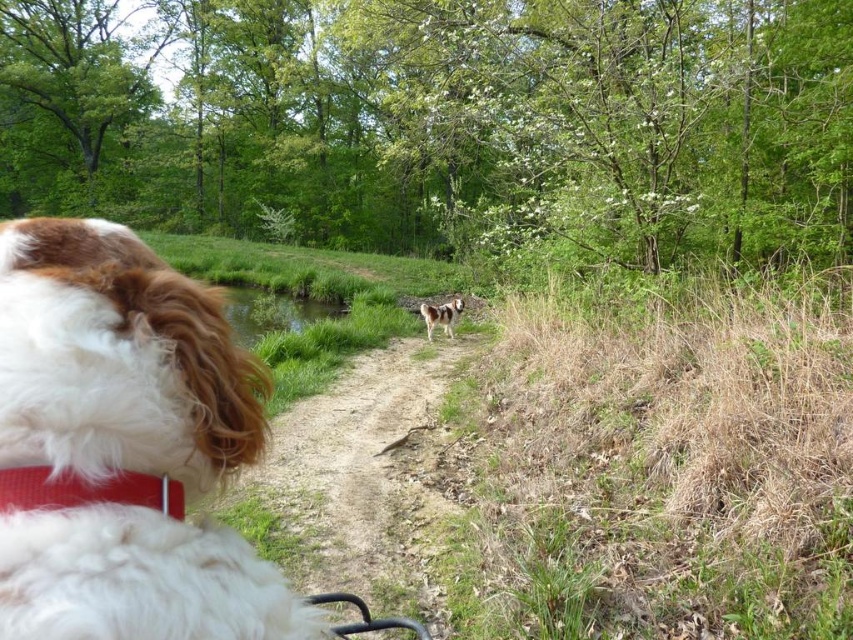
You are a photographer trying to capture the brown and white fur at center and the red fabric neckband at lower left in a single shot. Based on their positions, which object is closer to the camera?

The red fabric neckband at lower left is positioned under the brown and white fur at center, meaning it is closer to the camera since it appears beneath the fur in the image.

You are holding a 40 cm long stick and want to touch the point at coordinate point (x=18, y=280) without moving your position. Can your stick reach that point?

The distance of point (x=18, y=280) from camera is 48.29 centimeters. Since the stick is only 40 cm long, it cannot reach the point.

You are a hiker who wants to place a 40 feet long tent between the red fabric neckband at lower left and the brown and white fur at center. Is there enough space?

The distance between the red fabric neckband at lower left and the brown and white fur at center is 35.11 feet, which is shorter than the 40 feet tent. Therefore, the tent cannot be placed between them.